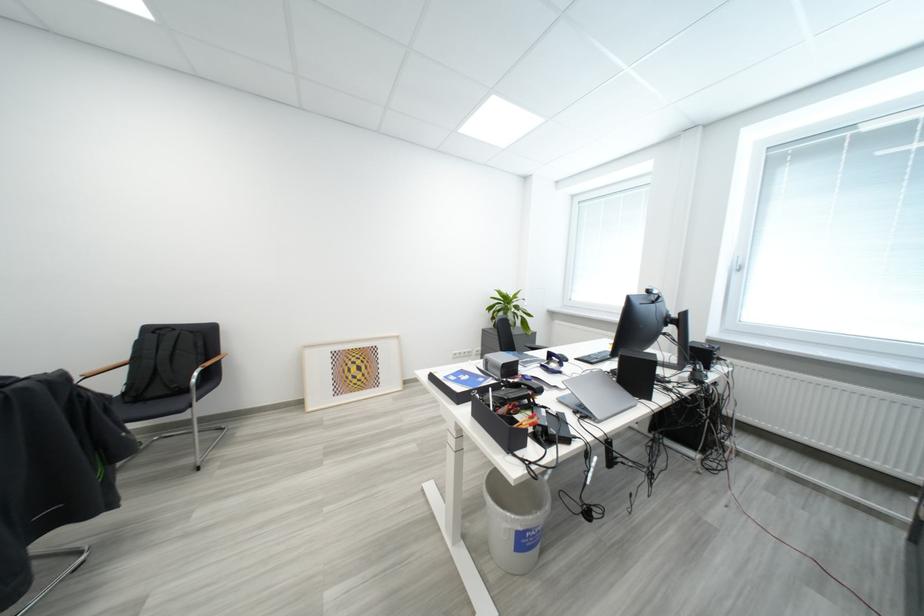
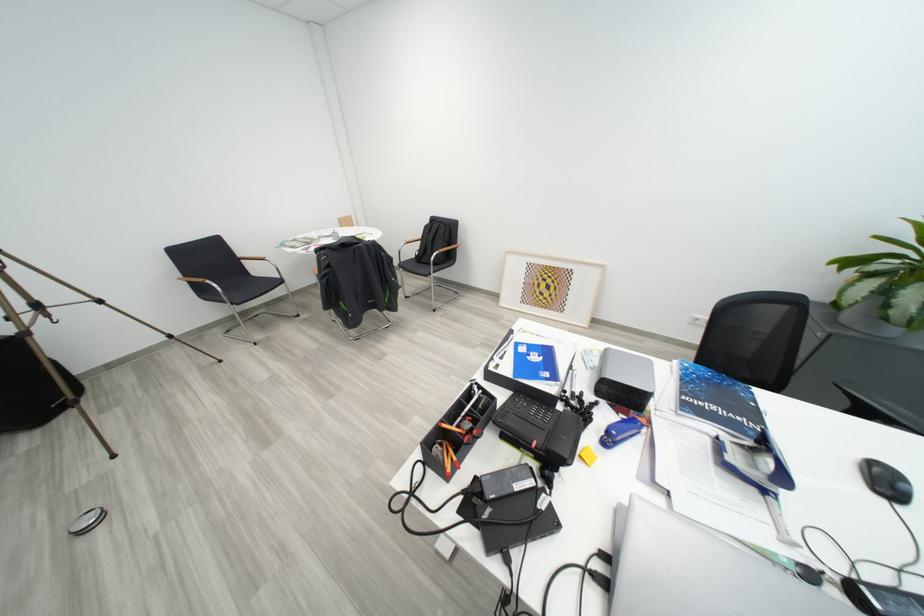
Question: I am providing you with two images of the same scene from different viewpoints. Which of the following objects are not visible in image2?

Choices:
 (A) wooden chair armrest
 (B) backpack top handle
 (C) blue stapler
 (D) none of these

Answer: (D)